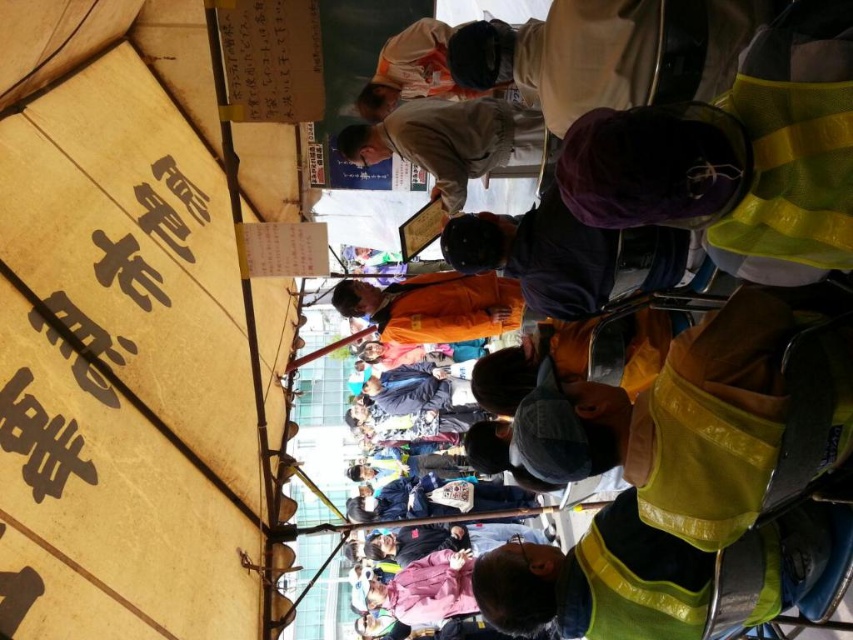
You are planning to hang a new decorative banner that is 2 meters wide. The banner needs to be placed under the yellow canvas canopy at upper left and to the right of the brown paper sign at left. Based on the scene, will the available space between these two objects accommodate the banner?

The yellow canvas canopy at upper left is wider than the brown paper sign at left. Since the banner needs to be placed between them, the space available is likely sufficient to accommodate the 2 meter wide banner.

You are at the crowded outdoor event and need to locate the khaki cotton shirt at center. Where is the point at position (445, 140) in relation to the khaki cotton shirt at center?

The point at position (445, 140) is located on the khaki cotton shirt at center.